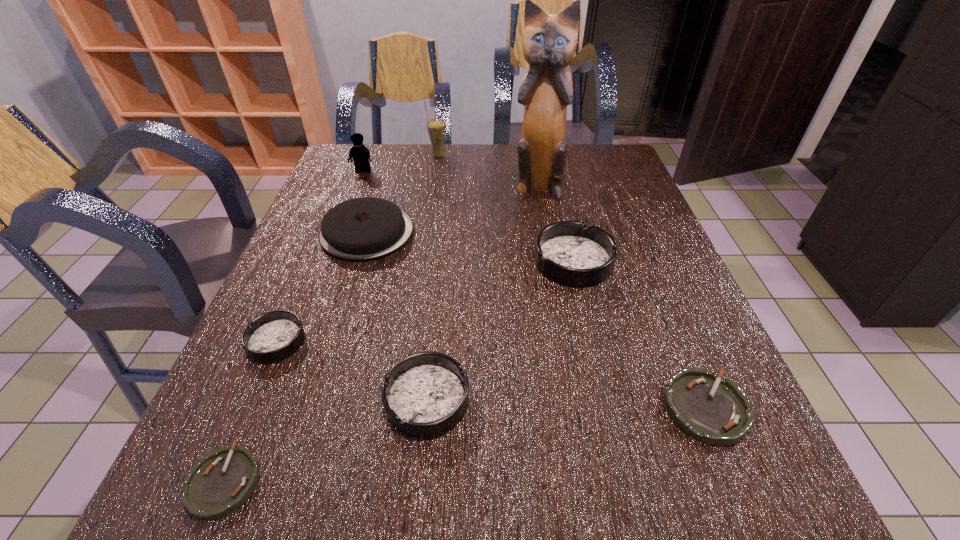
Image resolution: width=960 pixels, height=540 pixels. I want to click on cat, so click(549, 43).

Locate an element on the screen. The image size is (960, 540). the farthest object is located at coordinates (436, 127).

Where is `yellow straw for drinking`? The height and width of the screenshot is (540, 960). yellow straw for drinking is located at coordinates (436, 127).

Image resolution: width=960 pixels, height=540 pixels. What are the coordinates of `Lego` in the screenshot? It's located at (361, 155).

Find the location of a particular element. This screenshot has width=960, height=540. the seventh shortest object is located at coordinates (361, 155).

Locate an element on the screen. This screenshot has width=960, height=540. the sixth shortest object is located at coordinates (361, 229).

The width and height of the screenshot is (960, 540). I want to click on the farthest dark ashtray, so click(x=567, y=252).

The image size is (960, 540). What are the coordinates of `the fifth shortest object` in the screenshot? It's located at (567, 252).

Where is `the fourth shortest ashtray`? The width and height of the screenshot is (960, 540). the fourth shortest ashtray is located at coordinates (425, 394).

Find the location of `the nearest dark ashtray`. the nearest dark ashtray is located at coordinates point(425,394).